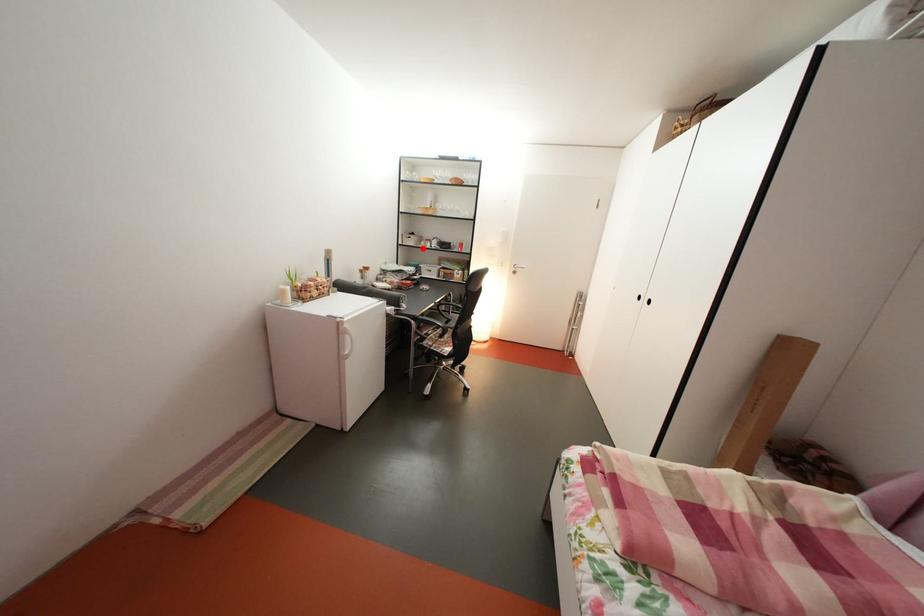
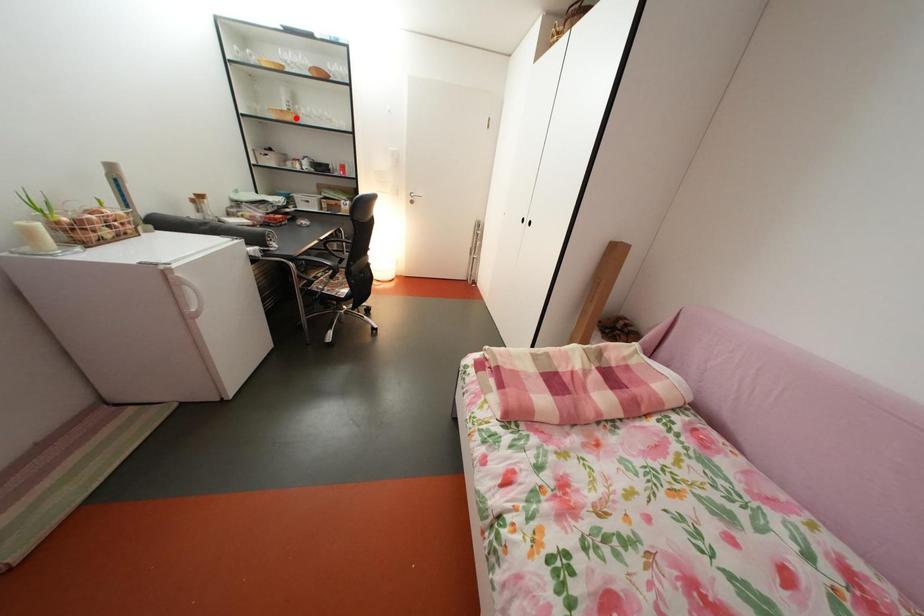
I am providing you with two images of the same scene from different viewpoints. A red point is marked on the first image and another point is marked on the second image. Are the points marked in image1 and image2 representing the same 3D position?

No